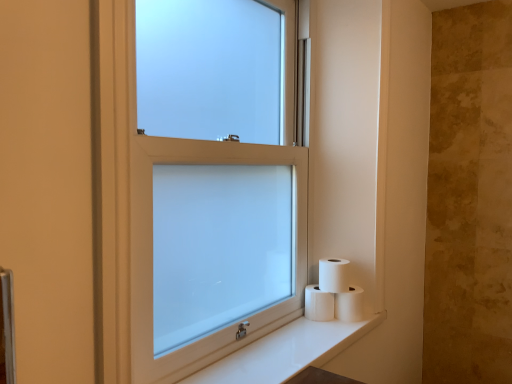
Find the location of a particular element. This screenshot has height=384, width=512. blank space situated above white glossy counter top at lower right (from a real-world perspective) is located at coordinates (290, 346).